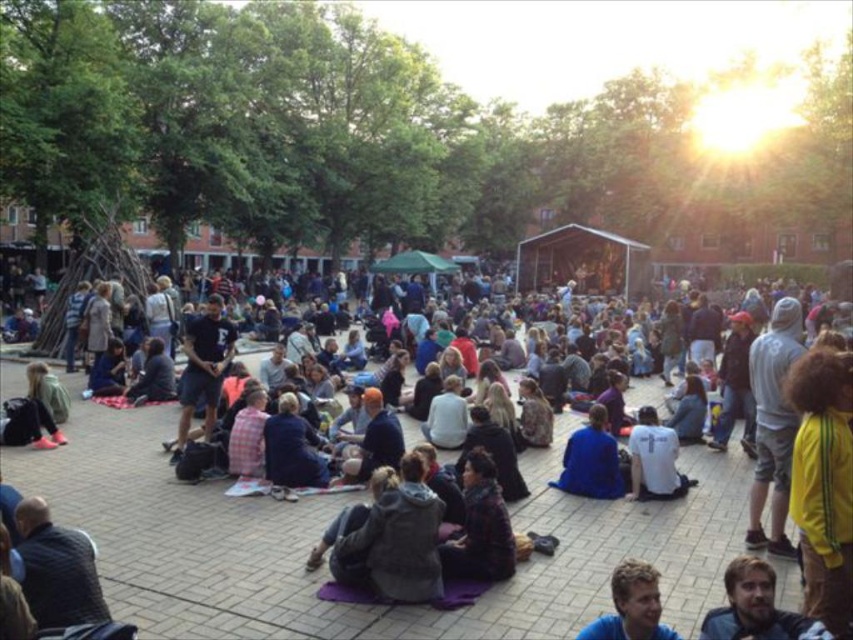
Can you confirm if dark blue denim shorts at center is positioned below white t-shirt at center?

No, dark blue denim shorts at center is not below white t-shirt at center.

Which is below, dark blue denim shorts at center or white t-shirt at center?

Positioned lower is white t-shirt at center.

Is point (178, 392) behind point (651, 413)?

Yes, point (178, 392) is behind point (651, 413).

The height and width of the screenshot is (640, 853). Identify the location of dark blue denim shorts at center. (202, 369).

Does point (651, 612) lie in front of point (561, 465)?

Yes, it is.

Is blue fabric at center wider than blue fabric jacket at center?

Yes.

Locate an element on the screen. blue fabric at center is located at coordinates (631, 605).

Locate an element on the screen. The height and width of the screenshot is (640, 853). blue fabric at center is located at coordinates (631, 605).

Is point (813, 627) closer to viewer compared to point (213, 356)?

Yes, it is in front of point (213, 356).

Is dark brown leather jacket at lower right behind dark blue denim shorts at center?

That is False.

Is point (769, 593) positioned behind point (202, 387)?

No, (769, 593) is closer to viewer.

At what (x,y) coordinates should I click in order to perform the action: click on dark brown leather jacket at lower right. Please return your answer as a coordinate pair (x, y). The height and width of the screenshot is (640, 853). Looking at the image, I should click on (755, 608).